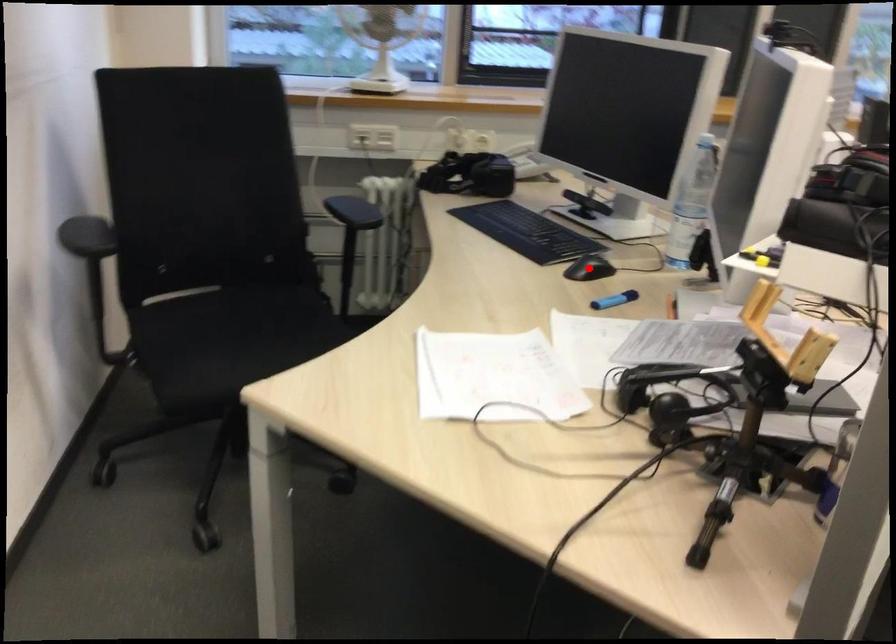
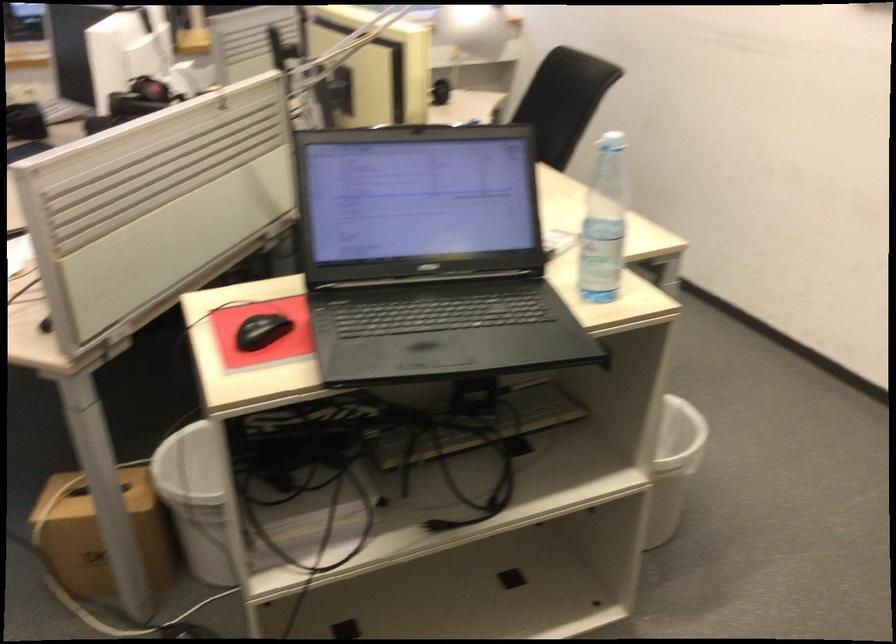
Question: I am providing you with two images of the same scene from different viewpoints. A red point is marked on the first image. Is the red point's position out of view in image 2?

Choices:
 (A) Yes
 (B) No

Answer: (A)